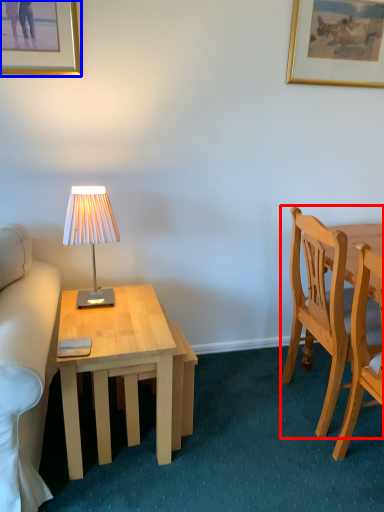
Question: Which of the following is the closest to the observer, chair (highlighted by a red box) or picture frame (highlighted by a blue box)?

Choices:
 (A) chair
 (B) picture frame

Answer: (A)